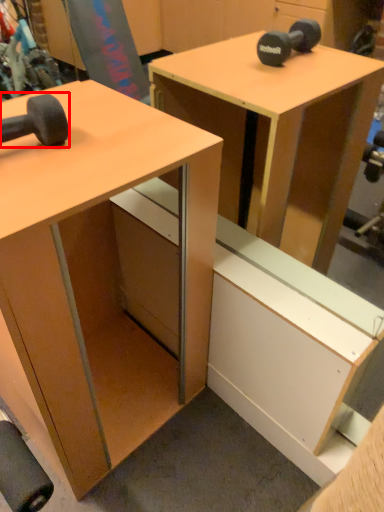
Question: Where is dumbbell (annotated by the red box) located in relation to desk in the image?

Choices:
 (A) right
 (B) left

Answer: (B)